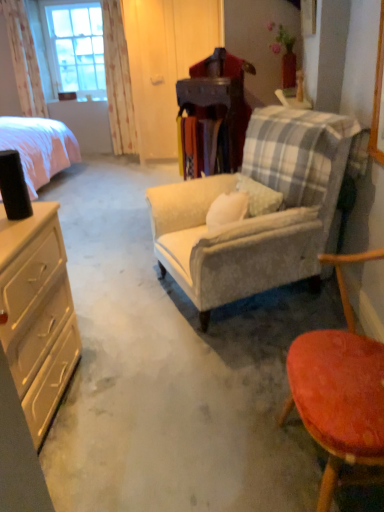
The width and height of the screenshot is (384, 512). In order to click on vacant space to the left of velvet beige armchair at center, arranged as the first chair when viewed from the back in this screenshot , I will do `click(112, 269)`.